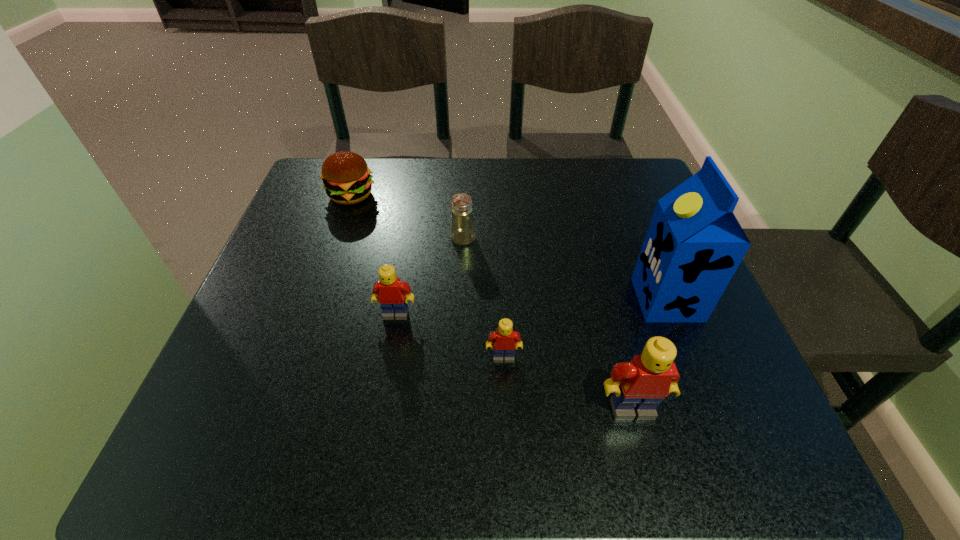
At what (x,y) coordinates should I click in order to perform the action: click on free space between the second farthest object and the second nearest object. Please return your answer as a coordinate pair (x, y). Image resolution: width=960 pixels, height=540 pixels. Looking at the image, I should click on (483, 298).

At what (x,y) coordinates should I click in order to perform the action: click on empty location between the fifth shortest object and the leftmost object. Please return your answer as a coordinate pair (x, y). This screenshot has width=960, height=540. Looking at the image, I should click on (492, 302).

You are a GUI agent. You are given a task and a screenshot of the screen. Output one action in this format:
    pyautogui.click(x=<x>, y=<y>)
    Task: Click on the free space between the tallest Lego and the fifth farthest object
    
    Given the screenshot: What is the action you would take?
    pyautogui.click(x=567, y=383)

At what (x,y) coordinates should I click in order to perform the action: click on free space between the nearest object and the second nearest Lego. Please return your answer as a coordinate pair (x, y). Looking at the image, I should click on (567, 383).

In order to click on vacant space that's between the fifth farthest object and the carton in this screenshot , I will do `click(586, 328)`.

Where is `vacant area that lies between the leftmost object and the tallest object`? vacant area that lies between the leftmost object and the tallest object is located at coordinates click(509, 247).

Locate an element on the screen. free space between the rightmost Lego and the hamburger is located at coordinates (492, 302).

The image size is (960, 540). Find the location of `the fourth closest object to the rightmost object`. the fourth closest object to the rightmost object is located at coordinates [389, 291].

Identify the location of the third closest object relative to the third object from right to left. (694, 244).

The image size is (960, 540). Find the location of `Lego that is the second closest to the second farthest Lego`. Lego that is the second closest to the second farthest Lego is located at coordinates (389, 291).